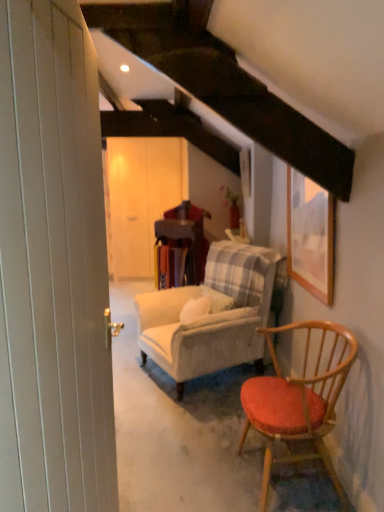
In order to face white wooden barn door at left, the 2th barn door positioned from the back, should I rotate leftwards or rightwards?

Rotate your view left by about 16.998°.

Locate an element on the screen. white wooden barn door at left, the 2th barn door positioned from the back is located at coordinates (52, 267).

Which is nearer, [54,82] or [287,195]?

Point [54,82] is closer to the camera than point [287,195].

Is white wooden barn door at left, arranged as the 1th barn door when viewed from the front, taller than wooden framed picture at upper right?

Indeed, white wooden barn door at left, arranged as the 1th barn door when viewed from the front, has a greater height compared to wooden framed picture at upper right.

From the image's perspective, which is below, white wooden barn door at left, arranged as the 1th barn door when viewed from the front, or wooden framed picture at upper right?

white wooden barn door at left, arranged as the 1th barn door when viewed from the front.

Which is in front, white wooden barn door at left, arranged as the 1th barn door when viewed from the front, or wooden framed picture at upper right?

white wooden barn door at left, arranged as the 1th barn door when viewed from the front, is in front.

Considering the positions of point (6, 12) and point (185, 330), is point (6, 12) closer or farther from the camera than point (185, 330)?

Point (6, 12) is positioned closer to the camera compared to point (185, 330).

Consider the image. From a real-world perspective, which is physically above, white wooden barn door at left, the 2th barn door positioned from the back, or velvet beige armchair at center?

In real-world perspective, white wooden barn door at left, the 2th barn door positioned from the back, is above.

Between white wooden barn door at left, arranged as the 1th barn door when viewed from the front, and velvet beige armchair at center, which one has larger width?

velvet beige armchair at center.

Which is behind, white wooden barn door at left, the 2th barn door positioned from the back, or velvet beige armchair at center?

velvet beige armchair at center.

From a real-world perspective, is white wood door at center, the first barn door from the back, beneath velvet beige armchair at center?

Actually, white wood door at center, the first barn door from the back, is physically above velvet beige armchair at center in the real world.

Considering the positions of objects white wood door at center, the 2th barn door viewed from the front, and velvet beige armchair at center in the image provided, who is behind, white wood door at center, the 2th barn door viewed from the front, or velvet beige armchair at center?

white wood door at center, the 2th barn door viewed from the front, is more distant.

Can you confirm if white wood door at center, the first barn door from the back, is shorter than velvet beige armchair at center?

No.

From a real-world perspective, does wooden table at center sit lower than white wood door at center, the 2th barn door viewed from the front?

Yes, from a real-world perspective, wooden table at center is beneath white wood door at center, the 2th barn door viewed from the front.

In the scene shown: Is wooden table at center smaller than white wood door at center, the first barn door from the back?

Correct, wooden table at center occupies less space than white wood door at center, the first barn door from the back.

Can you confirm if wooden table at center is shorter than white wood door at center, the first barn door from the back?

Indeed, wooden table at center has a lesser height compared to white wood door at center, the first barn door from the back.

Are wooden table at center and white wood door at center, the 2th barn door viewed from the front, far apart?

Yes, wooden table at center and white wood door at center, the 2th barn door viewed from the front, are located far from each other.

From a real-world perspective, is wooden framed picture at upper right below wooden table at center?

No, from a real-world perspective, wooden framed picture at upper right is not under wooden table at center.

Is wooden framed picture at upper right thinner than wooden table at center?

Yes, wooden framed picture at upper right is thinner than wooden table at center.

Is wooden framed picture at upper right situated inside wooden table at center or outside?

The correct answer is: outside.

Consider the image. Is velvet beige armchair at center next to white wood door at center, the 2th barn door viewed from the front, and touching it?

They are not placed beside each other.

Can you confirm if velvet beige armchair at center is positioned to the right of white wood door at center, the first barn door from the back?

Yes.

Could white wood door at center, the first barn door from the back, be considered to be inside velvet beige armchair at center?

No, white wood door at center, the first barn door from the back, is not surrounded by velvet beige armchair at center.

Considering the points (229, 298) and (121, 162), which point is in front, point (229, 298) or point (121, 162)?

The point (229, 298) is closer.

Between velvet beige armchair at center and wooden framed picture at upper right, which one has larger size?

Bigger between the two is velvet beige armchair at center.

From the image's perspective, is velvet beige armchair at center under wooden framed picture at upper right?

Yes, from the image's perspective, velvet beige armchair at center is beneath wooden framed picture at upper right.

Which of these two, velvet beige armchair at center or wooden framed picture at upper right, is thinner?

wooden framed picture at upper right.

Does velvet beige armchair at center come behind wooden framed picture at upper right?

Yes, the depth of velvet beige armchair at center is greater than that of wooden framed picture at upper right.

Identify the location of picture frame lying on the right of white wooden barn door at left, arranged as the 1th barn door when viewed from the front. (310, 236).

Locate an element on the screen. studio couch behind the white wooden barn door at left, arranged as the 1th barn door when viewed from the front is located at coordinates (211, 315).

Based on their spatial positions, is wooden framed picture at upper right or velvet beige armchair at center closer to white wooden barn door at left, arranged as the 1th barn door when viewed from the front?

wooden framed picture at upper right is closer to white wooden barn door at left, arranged as the 1th barn door when viewed from the front.

Looking at this image, looking at the image, which one is located closer to white wood door at center, the first barn door from the back, wooden framed picture at upper right or white wooden barn door at left, arranged as the 1th barn door when viewed from the front?

wooden framed picture at upper right lies closer to white wood door at center, the first barn door from the back, than the other object.

Estimate the real-world distances between objects in this image. Which object is further from velvet beige armchair at center, wooden table at center or white wood door at center, the first barn door from the back?

Among the two, white wood door at center, the first barn door from the back, is located further to velvet beige armchair at center.

Looking at the image, which one is located further to wooden framed picture at upper right, velvet beige armchair at center or wooden table at center?

wooden table at center is further to wooden framed picture at upper right.

From the image, which object appears to be nearer to wooden framed picture at upper right, wooden table at center or white wood door at center, the 2th barn door viewed from the front?

wooden table at center.

From the image, which object appears to be farther from white wood door at center, the first barn door from the back, wooden table at center or white wooden barn door at left, arranged as the 1th barn door when viewed from the front?

white wooden barn door at left, arranged as the 1th barn door when viewed from the front.

Estimate the real-world distances between objects in this image. Which object is further from wooden framed picture at upper right, white wooden barn door at left, the 2th barn door positioned from the back, or white wood door at center, the first barn door from the back?

white wood door at center, the first barn door from the back, is further to wooden framed picture at upper right.

From the image, which object appears to be nearer to white wooden barn door at left, arranged as the 1th barn door when viewed from the front, wooden table at center or wooden framed picture at upper right?

Based on the image, wooden framed picture at upper right appears to be nearer to white wooden barn door at left, arranged as the 1th barn door when viewed from the front.

Locate an element on the screen. table between velvet beige armchair at center and white wood door at center, the 2th barn door viewed from the front, in the front-back direction is located at coordinates click(182, 236).

You are a GUI agent. You are given a task and a screenshot of the screen. Output one action in this format:
    pyautogui.click(x=<x>, y=<y>)
    Task: Click on the studio couch positioned between white wooden barn door at left, arranged as the 1th barn door when viewed from the front, and wooden table at center from near to far
    The width and height of the screenshot is (384, 512).
    Given the screenshot: What is the action you would take?
    pyautogui.click(x=211, y=315)

You are a GUI agent. You are given a task and a screenshot of the screen. Output one action in this format:
    pyautogui.click(x=<x>, y=<y>)
    Task: Click on the picture frame between white wooden barn door at left, arranged as the 1th barn door when viewed from the front, and velvet beige armchair at center in the front-back direction
    
    Given the screenshot: What is the action you would take?
    pyautogui.click(x=310, y=236)

What are the coordinates of `table positioned between wooden framed picture at upper right and white wood door at center, the first barn door from the back, from near to far` in the screenshot? It's located at (182, 236).